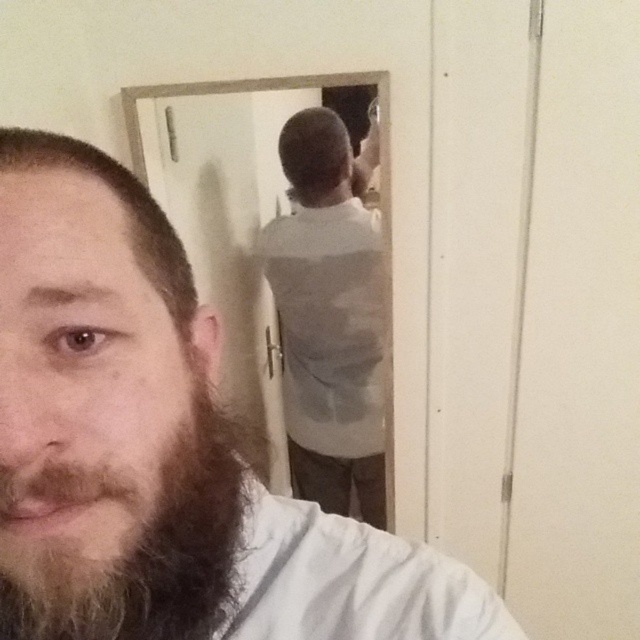
You are a photographer setting up a portrait shoot. You notice the white matte shirt at center and the dark brown curly beard at left in your frame. Which object occupies a larger portion of the vertical space in the image?

The white matte shirt at center has a greater height compared to the dark brown curly beard at left, so it occupies a larger portion of the vertical space in the image.

You are a fashion designer observing the image. You need to determine which item, the white matte shirt at center or the dark brown curly beard at left, would require more fabric to create a replica. Based on the description, which one would need more material?

The white matte shirt at center has a larger size compared to the dark brown curly beard at left, so it would require more fabric to create a replica.

You are a photographer setting up a shoot in this room. You need to position a light source to the left of the dark brown curly beard at left and to the right of the white matte shirt at center. Is this possible given their positions?

The white matte shirt at center is to the right of the dark brown curly beard at left, so placing a light source to the left of the dark brown curly beard at left would be outside the current frame. Therefore, it is not possible to position the light source as described without moving the subjects.